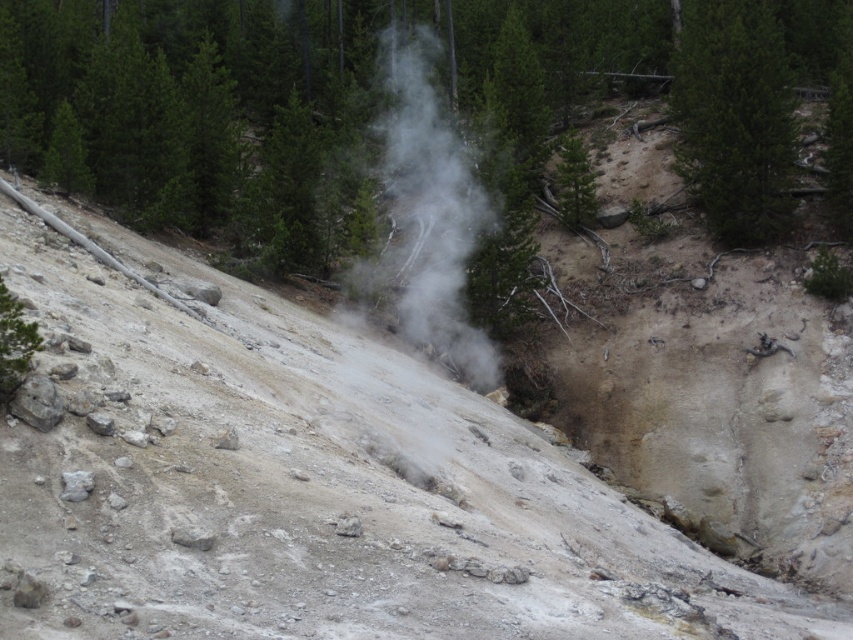
Question: Observing the image, what is the correct spatial positioning of dull gray rock at center in reference to green matte tree at upper right?

Choices:
 (A) above
 (B) below

Answer: (B)

Question: Which point is farther to the camera?

Choices:
 (A) (456, 179)
 (B) (784, 230)

Answer: (A)

Question: Can you confirm if dull gray rock at center is positioned below green matte tree at upper right?

Choices:
 (A) yes
 (B) no

Answer: (A)

Question: Does dull gray rock at center appear on the right side of green matte tree at upper right?

Choices:
 (A) no
 (B) yes

Answer: (A)

Question: Which point appears closest to the camera in this image?

Choices:
 (A) (102, 477)
 (B) (473, 164)
 (C) (738, 33)

Answer: (A)

Question: Which point is farther to the camera?

Choices:
 (A) green matte tree at upper right
 (B) white vapor at center
 (C) dull gray rock at center

Answer: (A)